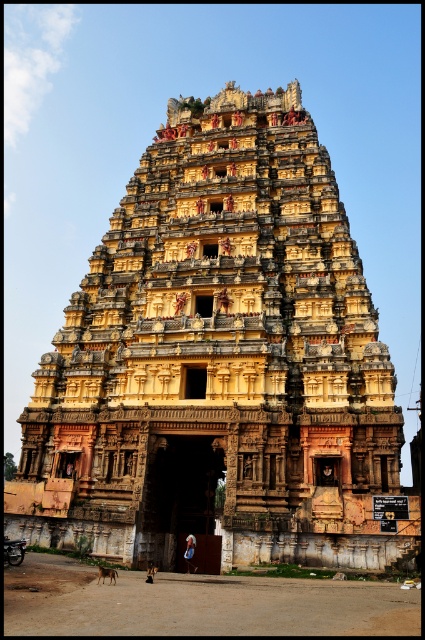
You are a photographer standing in front of the yellow stone hindu temple at center and the blue fabric headscarf at center. You want to take a photo that captures both objects in the frame. Which object should you focus on to ensure both are visible in the photo?

To ensure both the yellow stone hindu temple at center and the blue fabric headscarf at center are visible in the photo, focus on the yellow stone hindu temple at center since it is larger and will dominate the frame, allowing the smaller blue fabric headscarf at center to be included as well.

You are standing in front of the temple and want to take a photo that includes both the yellow stone hindu temple at center and the carved stone archway at center. Which object should be placed to the left in the photo?

The carved stone archway at center should be placed to the left in the photo because the yellow stone hindu temple at center is positioned on the right side of it.